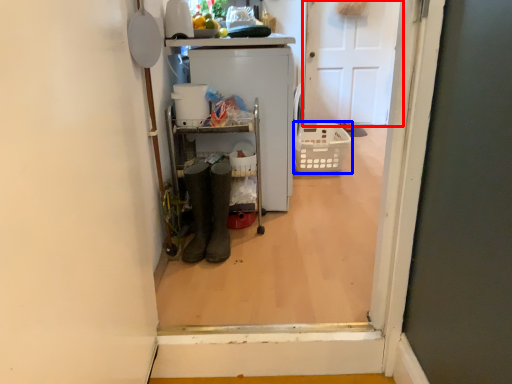
Question: Which of the following is the closest to the observer, door (highlighted by a red box) or basket (highlighted by a blue box)?

Choices:
 (A) door
 (B) basket

Answer: (B)